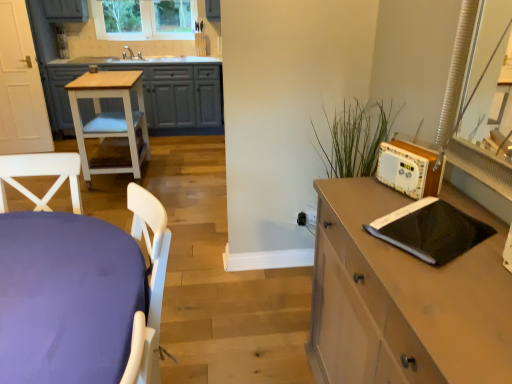
At what (x,y) coordinates should I click in order to perform the action: click on free space to the left of black matte notebook at right. Please return your answer as a coordinate pair (x, y). The image size is (512, 384). Looking at the image, I should click on (360, 228).